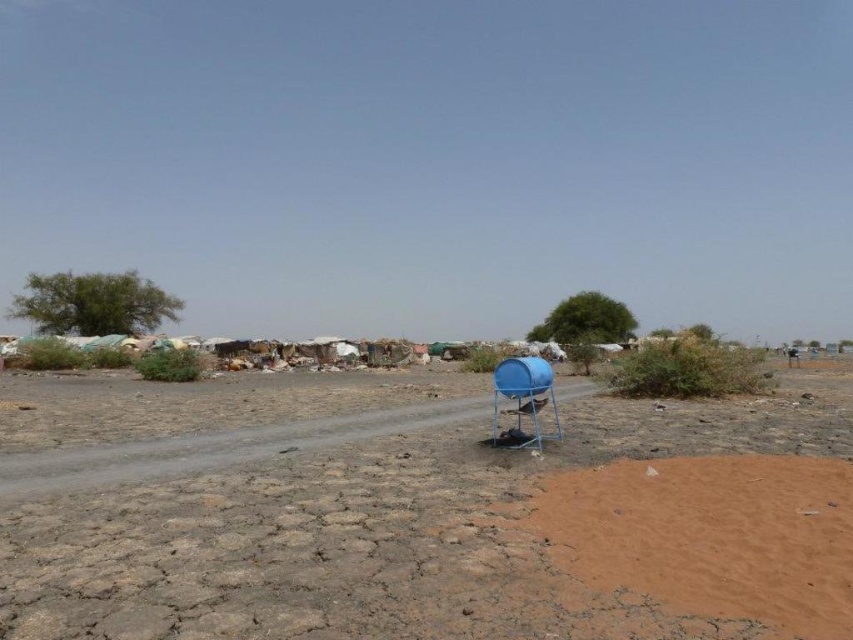
How much distance is there between dried mud dirt field at center and blue plastic barrel at center-right?

The distance of dried mud dirt field at center from blue plastic barrel at center-right is 5.23 meters.

Does point (746, 397) lie behind point (495, 374)?

Yes, point (746, 397) is farther from viewer.

Locate an element on the screen. dried mud dirt field at center is located at coordinates (374, 531).

Who is positioned more to the right, dried mud dirt field at center or brown sandy ground at lower right?

brown sandy ground at lower right

Which is more to the left, dried mud dirt field at center or brown sandy ground at lower right?

dried mud dirt field at center

Does point (49, 410) come farther from viewer compared to point (631, 561)?

Yes, point (49, 410) is farther from viewer.

Where is `dried mud dirt field at center`? dried mud dirt field at center is located at coordinates (374, 531).

Does point (717, 572) lie behind point (495, 384)?

No, (717, 572) is in front of (495, 384).

Can you confirm if brown sandy ground at lower right is taller than blue plastic barrel at center-right?

In fact, brown sandy ground at lower right may be shorter than blue plastic barrel at center-right.

Who is more forward, (622,499) or (505,362)?

Point (622,499) is in front.

The image size is (853, 640). I want to click on brown sandy ground at lower right, so click(x=712, y=536).